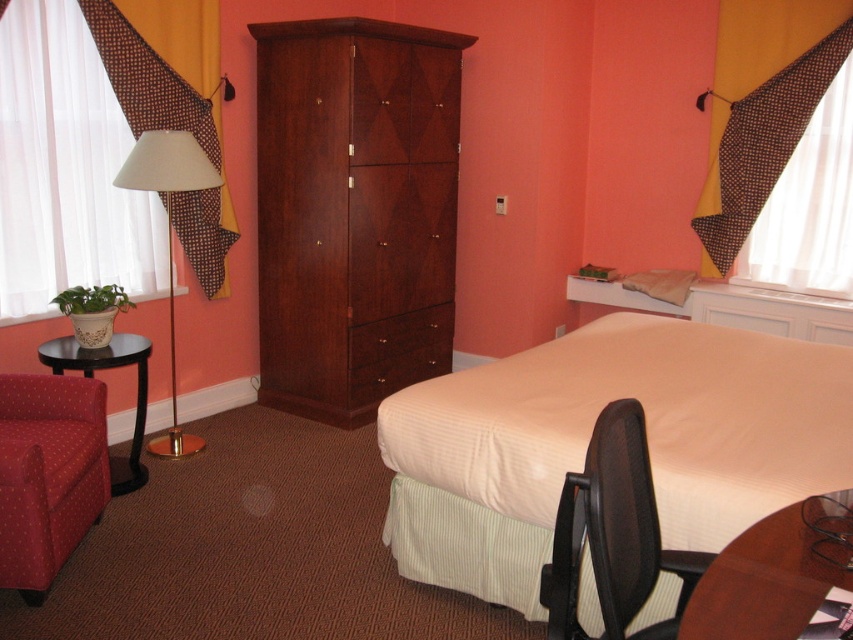
Is white textured bed at center bigger than white fabric lamp at left?

Indeed, white textured bed at center has a larger size compared to white fabric lamp at left.

Who is more distant from viewer, (695, 538) or (186, 449)?

Positioned behind is point (186, 449).

Where is `white textured bed at center`? The height and width of the screenshot is (640, 853). white textured bed at center is located at coordinates (589, 438).

Which is behind, point (13, 504) or point (392, 376)?

Point (392, 376)

Is red fabric swivel chair at lower left bigger than brown wood drawer at center?

No.

Does point (68, 422) come in front of point (421, 323)?

Yes, point (68, 422) is in front of point (421, 323).

Locate an element on the screen. This screenshot has width=853, height=640. red fabric swivel chair at lower left is located at coordinates (48, 474).

Is black mesh office chair at lower right shorter than brown wood drawer at center?

Yes, black mesh office chair at lower right is shorter than brown wood drawer at center.

Is black mesh office chair at lower right to the left of brown wood drawer at center from the viewer's perspective?

No, black mesh office chair at lower right is not to the left of brown wood drawer at center.

What do you see at coordinates (613, 534) in the screenshot? The image size is (853, 640). I see `black mesh office chair at lower right` at bounding box center [613, 534].

Find the location of a particular element. The width and height of the screenshot is (853, 640). black mesh office chair at lower right is located at coordinates (613, 534).